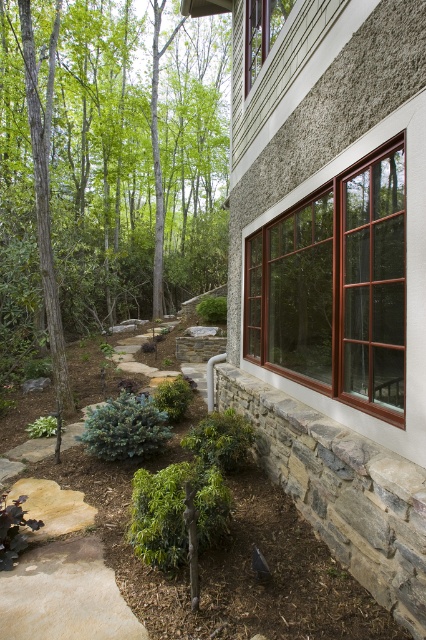
You are standing in front of the modern house and want to know which object is taller between the green leafy tree at upper left and the brown glass window at center right. Can you determine this based on the scene?

The green leafy tree at upper left is taller than the brown glass window at center right according to the description.

You are standing in front of the house and notice the green leafy tree at upper left and the brown glass window at center right. Which object is positioned to the left of the other?

The green leafy tree at upper left is positioned to the left of the brown glass window at center right.